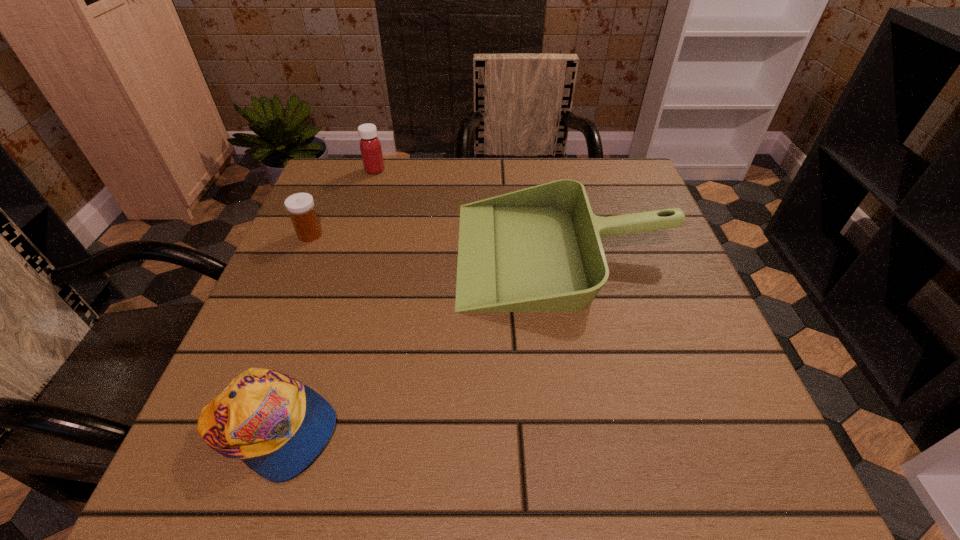
At what (x,y) coordinates should I click in order to perform the action: click on vacant space in between the taller medicine and the cap. Please return your answer as a coordinate pair (x, y). This screenshot has width=960, height=540. Looking at the image, I should click on (323, 300).

Locate an element on the screen. vacant area that lies between the farthest object and the nearest object is located at coordinates (323, 300).

Where is `free area in between the dustpan and the nearest object`? free area in between the dustpan and the nearest object is located at coordinates (418, 341).

Where is `object that stands as the third closest to the nearest object`? object that stands as the third closest to the nearest object is located at coordinates (370, 146).

Point out which object is positioned as the second nearest to the taller medicine. Please provide its 2D coordinates. Your answer should be formatted as a tuple, i.e. [(x, y)], where the tuple contains the x and y coordinates of a point satisfying the conditions above.

[(539, 249)]

Image resolution: width=960 pixels, height=540 pixels. I want to click on vacant area in the image that satisfies the following two spatial constraints: 1. on the front side of the farthest object; 2. on the bill of the cap, so click(294, 429).

At what (x,y) coordinates should I click in order to perform the action: click on free space that satisfies the following two spatial constraints: 1. on the back side of the right medicine; 2. on the left side of the left medicine. Please return your answer as a coordinate pair (x, y). Looking at the image, I should click on (338, 170).